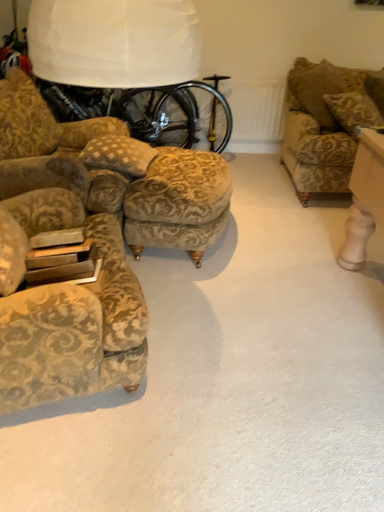
Question: Considering the positions of gold-patterned fabric stool at center and patterned fabric pillow at center in the image, is gold-patterned fabric stool at center taller or shorter than patterned fabric pillow at center?

Choices:
 (A) tall
 (B) short

Answer: (A)

Question: Do you think gold-patterned fabric stool at center is within patterned fabric pillow at center, or outside of it?

Choices:
 (A) inside
 (B) outside

Answer: (B)

Question: Which of these objects is positioned farthest from the white fabric lampshade at upper center?

Choices:
 (A) velvet floral armchair at left
 (B) gold-patterned fabric stool at center
 (C) gold-patterned fabric couch at upper right
 (D) patterned fabric pillow at center

Answer: (C)

Question: Which of these objects is positioned closest to the gold-patterned fabric couch at upper right?

Choices:
 (A) patterned fabric pillow at center
 (B) gold-patterned fabric stool at center
 (C) white fabric lampshade at upper center
 (D) velvet floral armchair at left

Answer: (B)